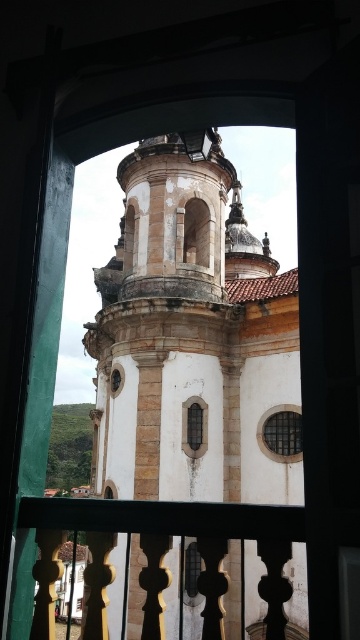
Question: Can you confirm if metallic grid window at center is bigger than clear glass window at center?

Choices:
 (A) yes
 (B) no

Answer: (A)

Question: Does metallic grid window at center lie in front of clear glass window at center?

Choices:
 (A) yes
 (B) no

Answer: (B)

Question: Which object appears farthest from the camera in this image?

Choices:
 (A) polished wood railing at center
 (B) clear glass window at center

Answer: (B)

Question: Which point is farther to the camera?

Choices:
 (A) polished wood railing at center
 (B) metallic grid window at center

Answer: (B)

Question: Is metallic grid window at center above clear glass window at center?

Choices:
 (A) yes
 (B) no

Answer: (B)

Question: Which point appears farthest from the camera in this image?

Choices:
 (A) (228, 573)
 (B) (290, 442)

Answer: (B)